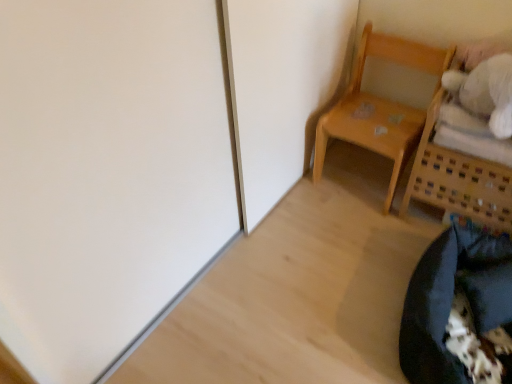
Find the location of `free region on the left part of wooden basket at upper right, the 2th furniture positioned from the left`. free region on the left part of wooden basket at upper right, the 2th furniture positioned from the left is located at coordinates (373, 234).